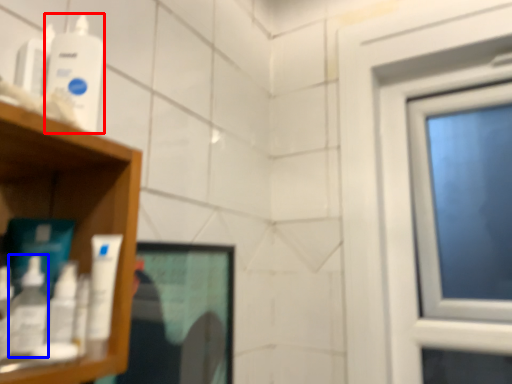
Question: Among these objects, which one is farthest to the camera, mouthwash (highlighted by a red box) or mouthwash (highlighted by a blue box)?

Choices:
 (A) mouthwash
 (B) mouthwash

Answer: (A)